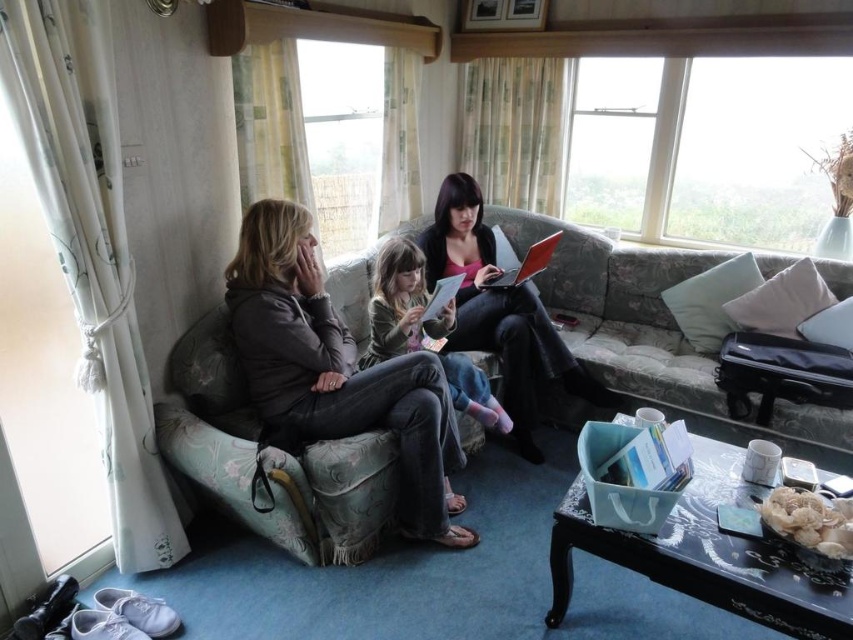
Question: Which of the following is the closest to the observer?

Choices:
 (A) matte gray sweater at left
 (B) floral fabric couch at center

Answer: (A)

Question: Which is nearer to the white paper book at lower center?

Choices:
 (A) white paper book at center
 (B) matte black laptop at center
 (C) floral fabric couch at center

Answer: (A)

Question: Is the position of white paper book at lower center less distant than that of white paper book at center?

Choices:
 (A) no
 (B) yes

Answer: (B)

Question: Is matte black laptop at center smaller than white paper book at center?

Choices:
 (A) yes
 (B) no

Answer: (B)

Question: Which is nearer to the metallic silver laptop at center?

Choices:
 (A) floral fabric couch at center
 (B) matte black laptop at center
 (C) matte gray sweater at left

Answer: (B)

Question: From the image, what is the correct spatial relationship of matte gray sweater at left in relation to matte black laptop at center?

Choices:
 (A) left
 (B) right

Answer: (A)